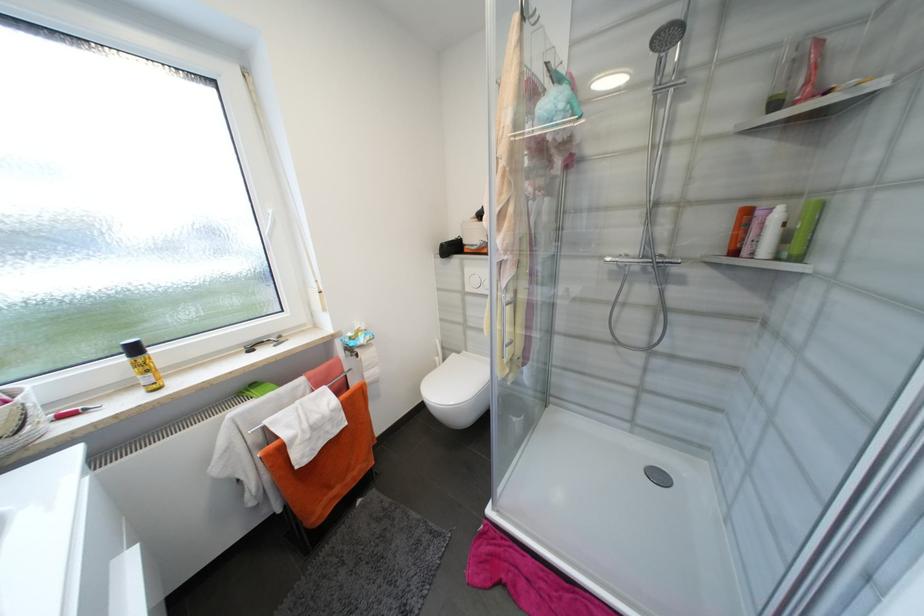
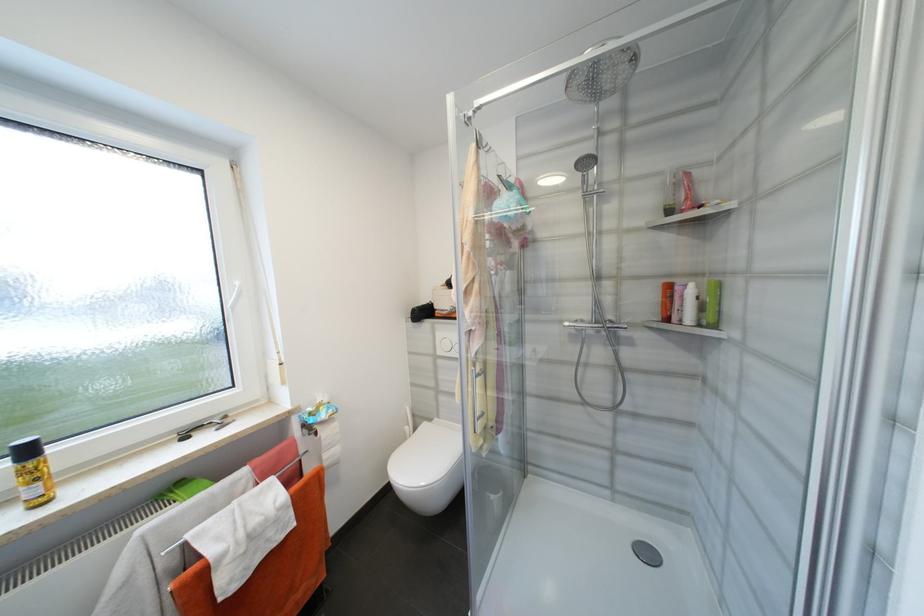
In the second image, find the point that corresponds to (362,357) in the first image.

(322, 435)